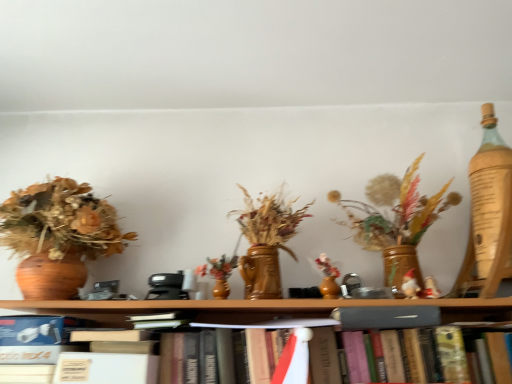
The image size is (512, 384). Identify the location of free location above matte gray book at center (from a real-world perspective). (386, 306).